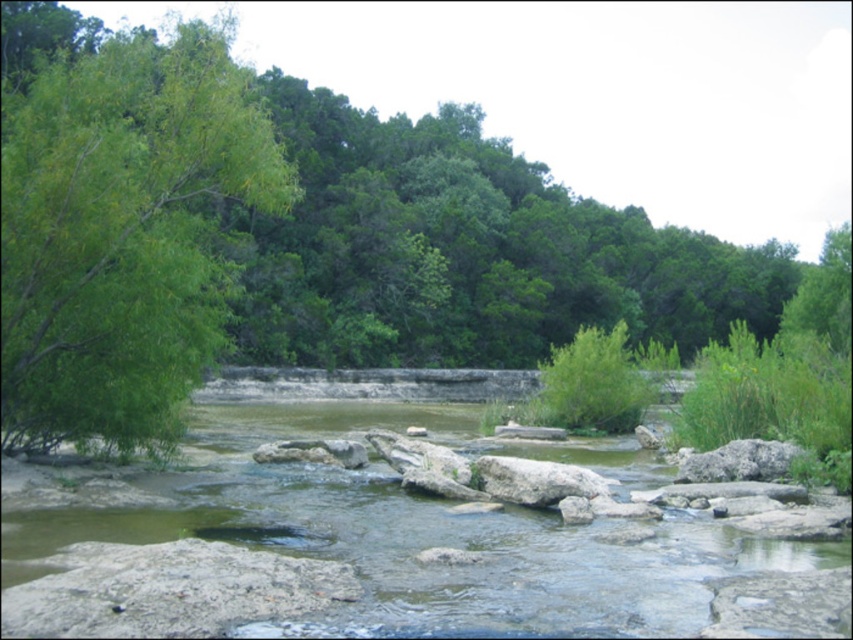
Question: Which object is positioned closest to the green leafy tree at left?

Choices:
 (A) gray/rough rock at center
 (B) green stone river at center

Answer: (B)

Question: Which point is farther from the camera taking this photo?

Choices:
 (A) (6, 368)
 (B) (613, 451)
 (C) (561, 497)

Answer: (B)

Question: Can you confirm if green stone river at center is wider than gray/rough rock at center?

Choices:
 (A) no
 (B) yes

Answer: (B)

Question: Is green leafy tree at left to the right of gray/rough rock at center from the viewer's perspective?

Choices:
 (A) yes
 (B) no

Answer: (B)

Question: Is green stone river at center wider than gray/rough rock at center?

Choices:
 (A) yes
 (B) no

Answer: (A)

Question: Which of the following is the closest to the observer?

Choices:
 (A) (192, 125)
 (B) (592, 493)

Answer: (B)